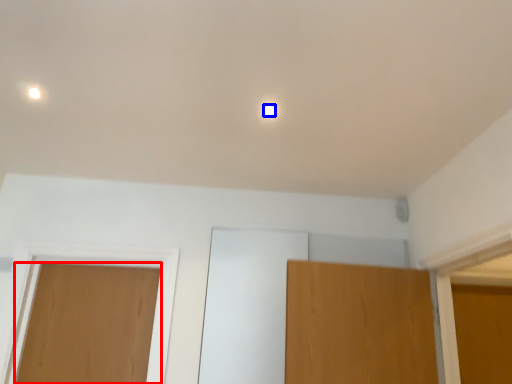
Question: Which point is closer to the camera, door (highlighted by a red box) or dot (highlighted by a blue box)?

Choices:
 (A) door
 (B) dot

Answer: (B)